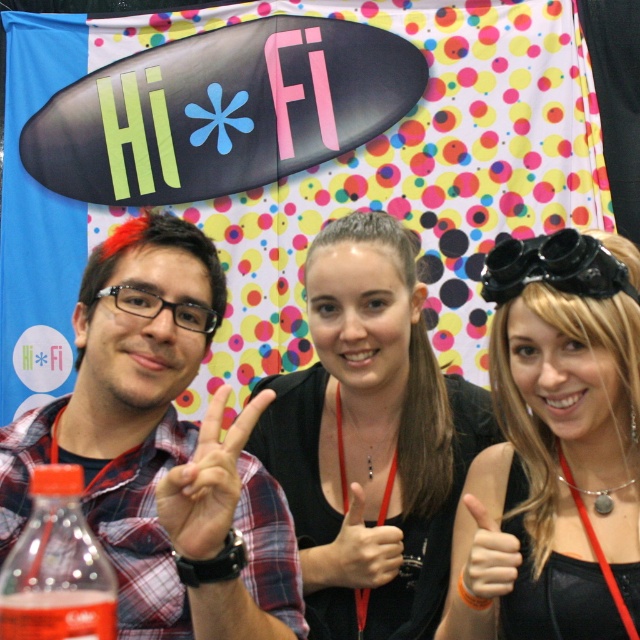
Identify the location of plaid shirt at center. The width and height of the screenshot is (640, 640). (161, 449).

Is point (164, 538) farther from viewer compared to point (355, 573)?

No.

Locate an element on the screen. This screenshot has height=640, width=640. plaid shirt at center is located at coordinates [x=161, y=449].

Between point (216, 484) and point (506, 554), which one is positioned in front?

Positioned in front is point (216, 484).

Between matte plaid shirt at center left and smooth skin hand at center, which one is positioned higher?

Positioned higher is matte plaid shirt at center left.

Is point (204, 499) farther from camera compared to point (461, 568)?

No, (204, 499) is closer to viewer.

Find the location of a particular element. matte plaid shirt at center left is located at coordinates (208, 481).

Does point (636, 333) come behind point (381, 534)?

No, it is in front of (381, 534).

Between black matte goggles at upper center and black matte hand at center, which one appears on the right side from the viewer's perspective?

From the viewer's perspective, black matte goggles at upper center appears more on the right side.

What do you see at coordinates (556, 449) in the screenshot? The height and width of the screenshot is (640, 640). I see `black matte goggles at upper center` at bounding box center [556, 449].

Find the location of a particular element. Image resolution: width=640 pixels, height=640 pixels. black matte goggles at upper center is located at coordinates pyautogui.click(x=556, y=449).